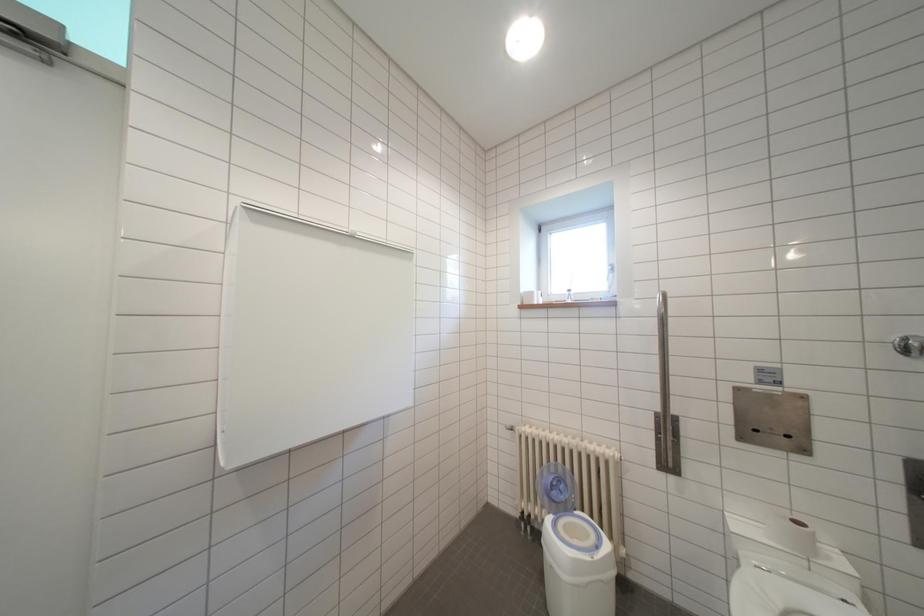
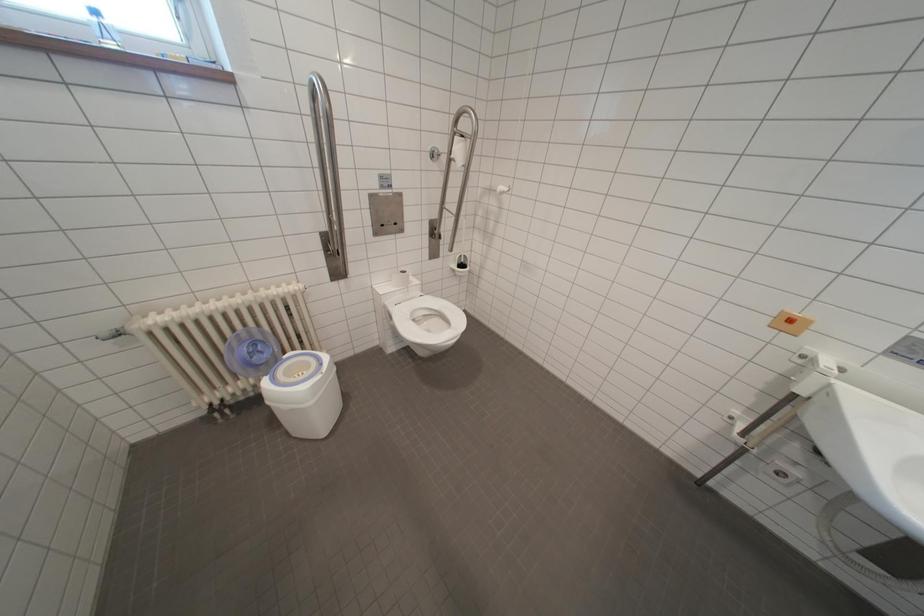
From the picture: How did the camera likely rotate?

The rotation direction of the camera is right-down.